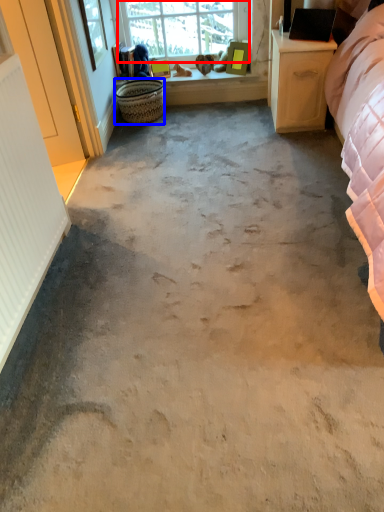
Question: Which of the following is the closest to the observer, window (highlighted by a red box) or basket (highlighted by a blue box)?

Choices:
 (A) window
 (B) basket

Answer: (B)